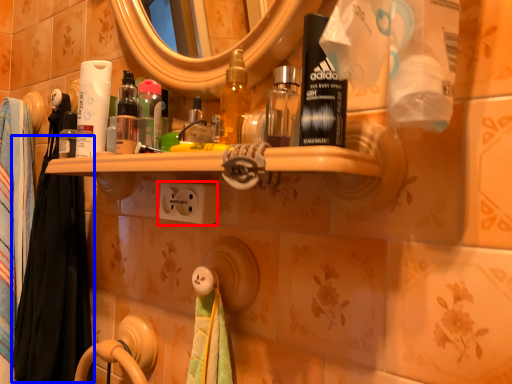
Question: Which object is closer to the camera taking this photo, electric outlet (highlighted by a red box) or bath towel (highlighted by a blue box)?

Choices:
 (A) electric outlet
 (B) bath towel

Answer: (A)